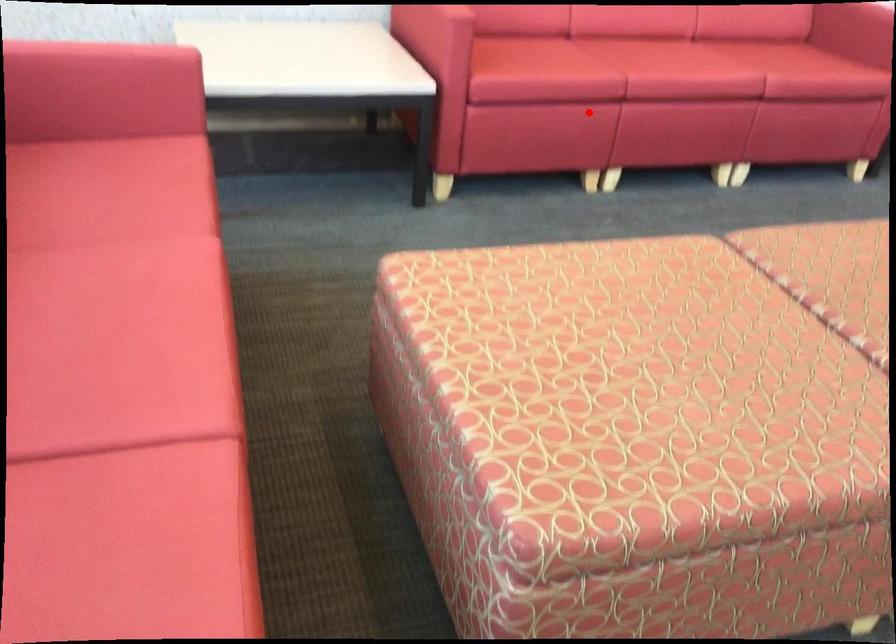
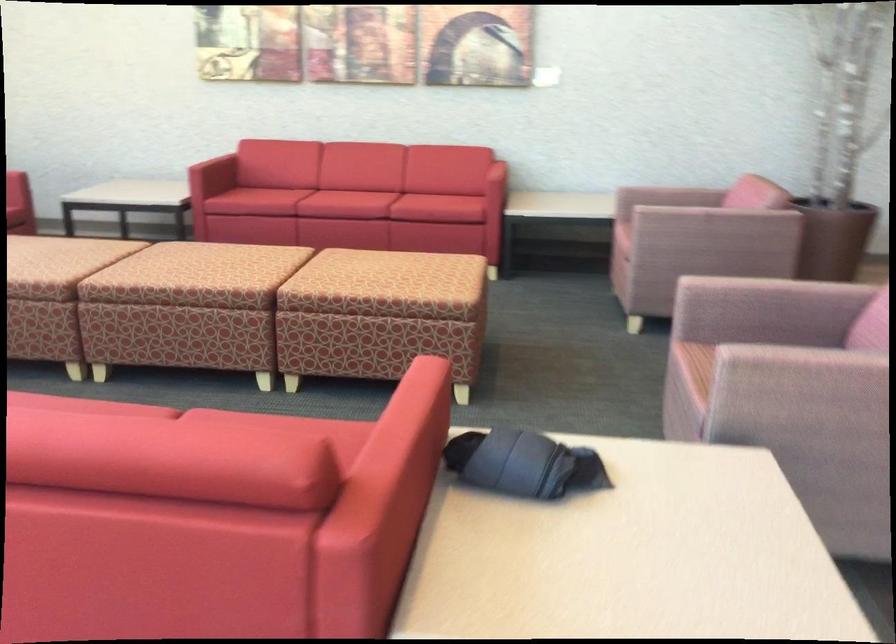
Question: I am providing you with two images of the same scene from different viewpoints. Image1 has a red point marked. In image2, the corresponding 3D location appears at what relative position? Reply with the corresponding letter.

Choices:
 (A) Closer
 (B) Farther

Answer: (B)